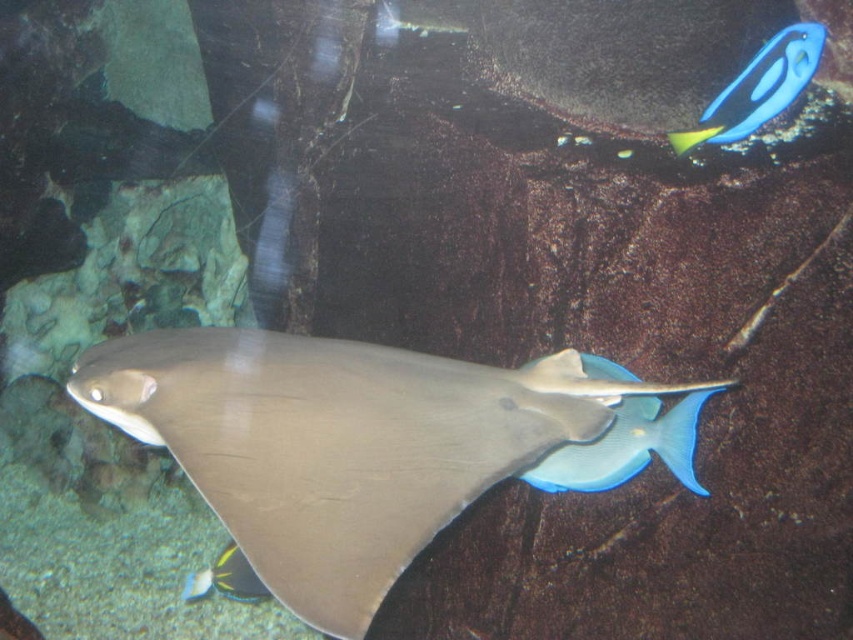
You are an aquarium caretaker who needs to feed the fish. You have a small fish food pellet. Which fish, the blue glossy fish at center or the shiny blue fish at lower left, would the pellet be more suitable for?

The blue glossy fish at center is smaller than the shiny blue fish at lower left, so the small fish food pellet would be more suitable for the blue glossy fish at center.

You are an underwater photographer aiming to capture the smooth gray stingray at center and the blue glossy fish at upper right in the same frame. Considering their sizes, which one would appear larger in your photo?

The smooth gray stingray at center would appear larger in the photo since its width surpasses that of the blue glossy fish at upper right.

You are an underwater photographer aiming to capture the blue glossy fish at center and the shiny blue fish at lower left in the same frame. Which fish is closer to the camera?

The blue glossy fish at center is closer to the camera since it is in front of the shiny blue fish at lower left.